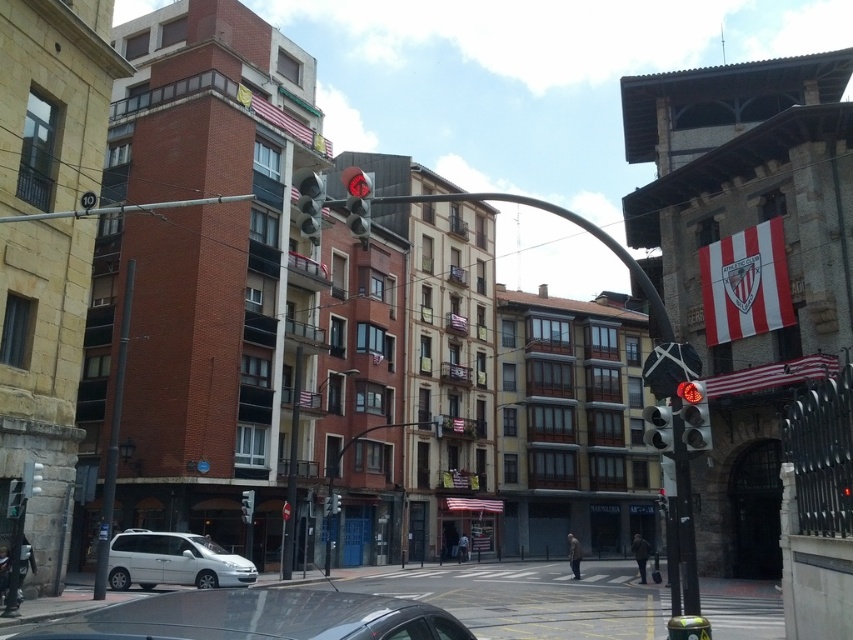
Who is taller, shiny black car at lower center or metallic traffic light at center?

With more height is shiny black car at lower center.

Is point (155, 636) positioned after point (643, 419)?

No, it is not.

Is point (338, 628) behind point (670, 440)?

No, it is in front of (670, 440).

You are a GUI agent. You are given a task and a screenshot of the screen. Output one action in this format:
    pyautogui.click(x=<x>, y=<y>)
    Task: Click on the shiny black car at lower center
    
    Given the screenshot: What is the action you would take?
    tap(257, 618)

This screenshot has width=853, height=640. What do you see at coordinates (694, 413) in the screenshot?
I see `metallic red traffic light at right` at bounding box center [694, 413].

Is metallic red traffic light at right below matte glass traffic light at center?

Yes.

Which is in front, point (686, 381) or point (341, 177)?

Point (686, 381)

At what (x,y) coordinates should I click in order to perform the action: click on metallic red traffic light at right. Please return your answer as a coordinate pair (x, y). This screenshot has width=853, height=640. Looking at the image, I should click on (694, 413).

Can you confirm if smooth metal pole at left is positioned to the left of metallic red traffic light at right?

Yes, smooth metal pole at left is to the left of metallic red traffic light at right.

Is smooth metal pole at left closer to camera compared to metallic red traffic light at right?

No, it is not.

I want to click on smooth metal pole at left, so click(x=113, y=440).